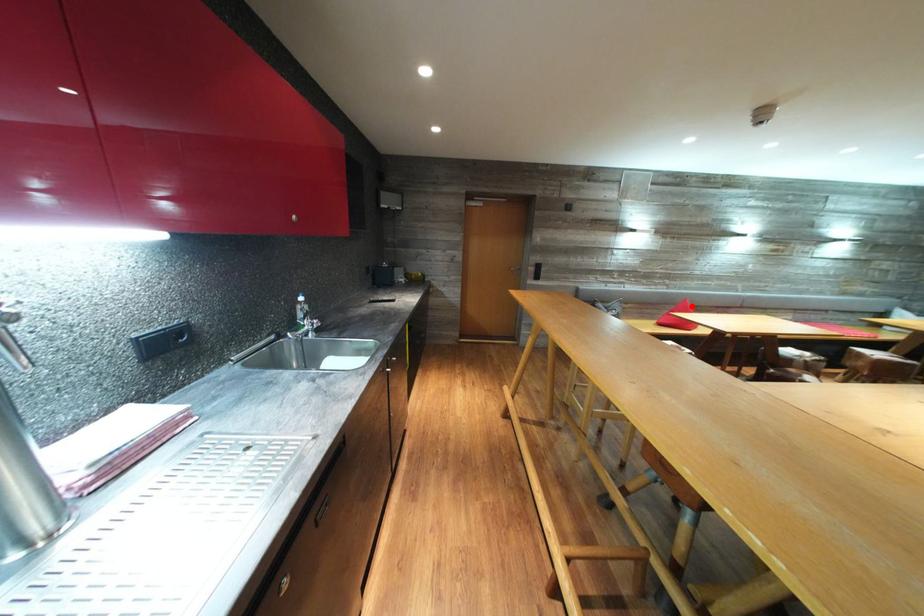
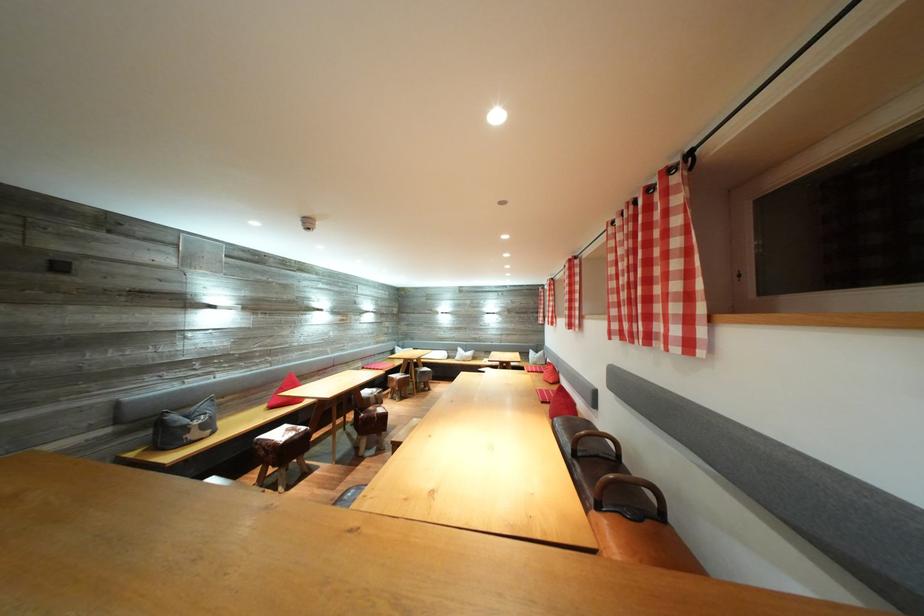
Question: I am providing you with two images of the same scene from different viewpoints. A red point is marked on the first image. Is the red point's position out of view in image 2?

Choices:
 (A) Yes
 (B) No

Answer: (B)